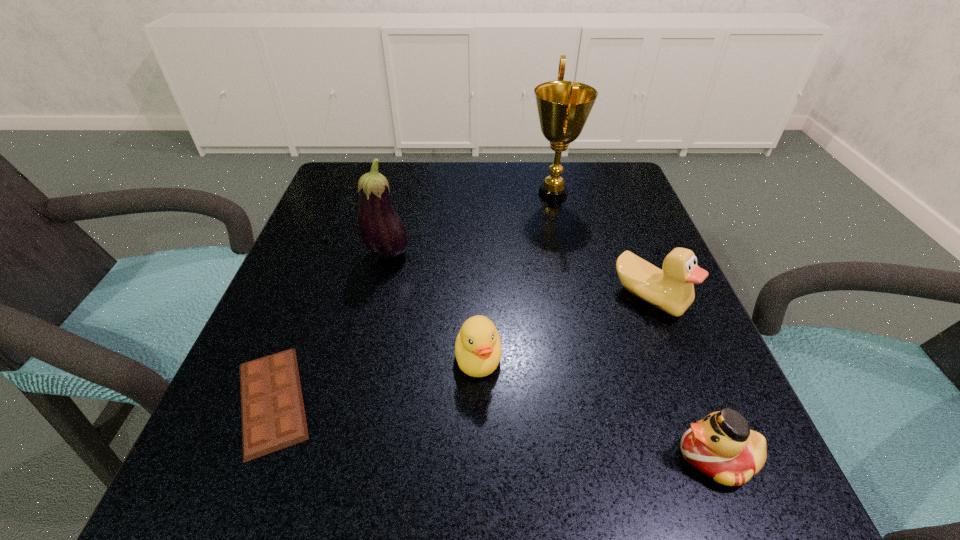
Locate an element on the screen. award is located at coordinates (563, 107).

Locate an element on the screen. This screenshot has height=540, width=960. the third object from right to left is located at coordinates (563, 107).

Locate an element on the screen. Image resolution: width=960 pixels, height=540 pixels. the second tallest object is located at coordinates pyautogui.click(x=383, y=232).

The height and width of the screenshot is (540, 960). In order to click on the fifth object from right to left in this screenshot , I will do `click(383, 232)`.

Locate an element on the screen. the fourth shortest object is located at coordinates (672, 290).

I want to click on the tallest duck, so click(x=672, y=290).

The width and height of the screenshot is (960, 540). Identify the location of the leftmost duck. (478, 350).

The image size is (960, 540). What are the coordinates of `the third object from left to right` in the screenshot? It's located at (478, 350).

Image resolution: width=960 pixels, height=540 pixels. Find the location of `the nearest duck`. the nearest duck is located at coordinates (722, 446).

This screenshot has height=540, width=960. What are the coordinates of `chocolate bar` in the screenshot? It's located at (273, 417).